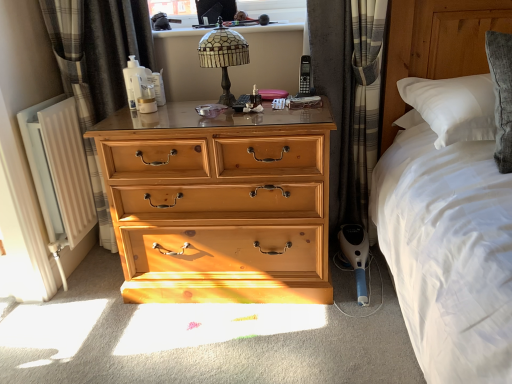
The height and width of the screenshot is (384, 512). In order to click on free space in front of wooden chest of drawers at center in this screenshot , I will do `click(229, 341)`.